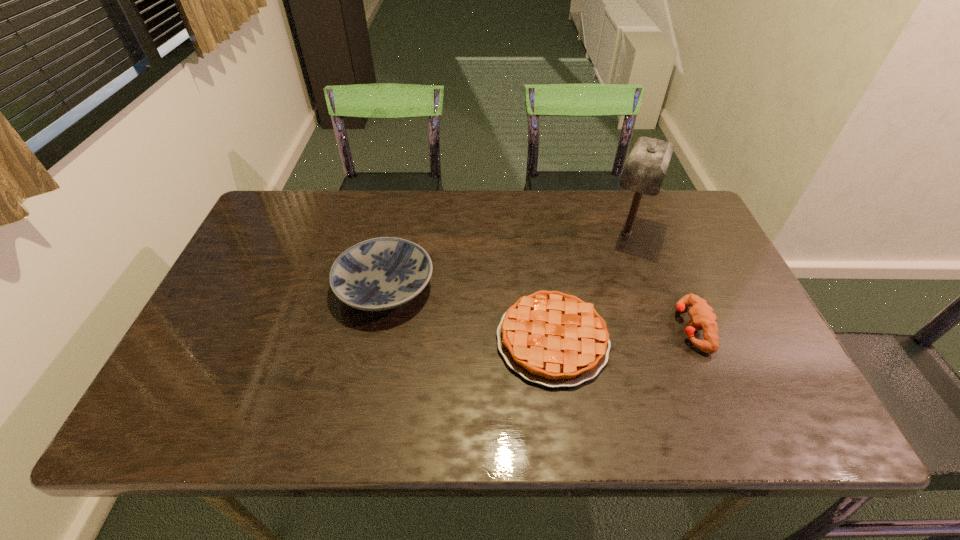
Locate an element on the screen. Image resolution: width=960 pixels, height=540 pixels. object that stands as the second closest to the tallest object is located at coordinates (702, 315).

In order to click on vacant area that satisfies the following two spatial constraints: 1. on the back side of the leftmost object; 2. on the right side of the tallest object in this screenshot , I will do `click(396, 233)`.